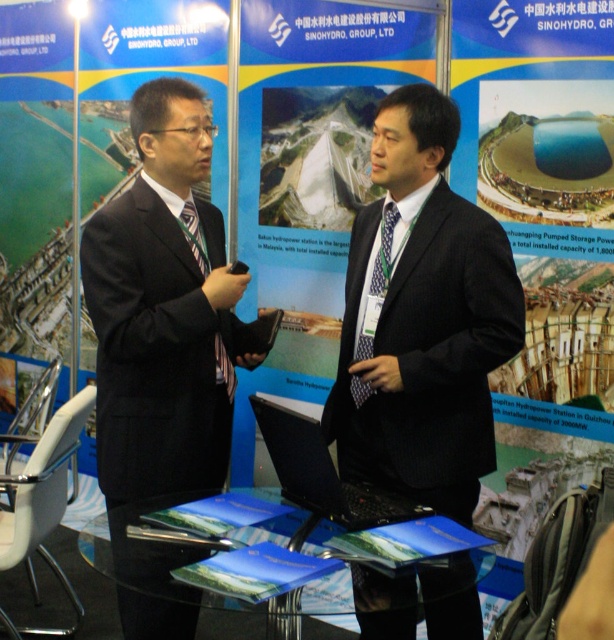
Question: Estimate the real-world distances between objects in this image. Which object is farther from the dark blue suit at center?

Choices:
 (A) matte black tie at center
 (B) black suit at left

Answer: (A)

Question: Among these objects, which one is nearest to the camera?

Choices:
 (A) matte black tie at center
 (B) dark blue suit at center
 (C) black suit at left

Answer: (C)

Question: In this image, where is black suit at left located relative to matte black tie at center?

Choices:
 (A) below
 (B) above

Answer: (B)

Question: Does black suit at left have a lesser width compared to matte black tie at center?

Choices:
 (A) yes
 (B) no

Answer: (B)

Question: Can you confirm if black suit at left is positioned to the left of matte black tie at center?

Choices:
 (A) no
 (B) yes

Answer: (B)

Question: Which point appears farthest from the camera in this image?

Choices:
 (A) (392, 216)
 (B) (196, 236)

Answer: (B)